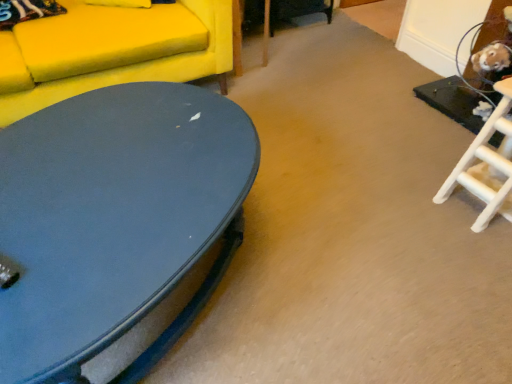
Locate an element on the screen. The height and width of the screenshot is (384, 512). matte yellow fabric couch at upper left is located at coordinates (111, 51).

Describe the element at coordinates (111, 51) in the screenshot. I see `matte yellow fabric couch at upper left` at that location.

Image resolution: width=512 pixels, height=384 pixels. I want to click on matte blue coffee table at lower left, so click(x=114, y=221).

The height and width of the screenshot is (384, 512). What do you see at coordinates (114, 221) in the screenshot?
I see `matte blue coffee table at lower left` at bounding box center [114, 221].

The width and height of the screenshot is (512, 384). What are the coordinates of `matte yellow fabric couch at upper left` in the screenshot? It's located at (111, 51).

Considering the positions of objects matte blue coffee table at lower left and matte yellow fabric couch at upper left in the image provided, who is more to the right, matte blue coffee table at lower left or matte yellow fabric couch at upper left?

Positioned to the right is matte blue coffee table at lower left.

Considering the relative positions of matte blue coffee table at lower left and matte yellow fabric couch at upper left in the image provided, is matte blue coffee table at lower left behind matte yellow fabric couch at upper left?

That is False.

Considering the points (51, 278) and (100, 46), which point is behind, point (51, 278) or point (100, 46)?

Point (100, 46)

From the image's perspective, is matte blue coffee table at lower left positioned above or below matte yellow fabric couch at upper left?

matte blue coffee table at lower left is situated lower than matte yellow fabric couch at upper left in the image.

Consider the image. From a real-world perspective, is matte blue coffee table at lower left located beneath matte yellow fabric couch at upper left?

Yes, from a real-world perspective, matte blue coffee table at lower left is under matte yellow fabric couch at upper left.

Consider the image. Considering the sizes of objects matte blue coffee table at lower left and matte yellow fabric couch at upper left in the image provided, who is wider, matte blue coffee table at lower left or matte yellow fabric couch at upper left?

Wider between the two is matte yellow fabric couch at upper left.

Considering the relative sizes of matte blue coffee table at lower left and matte yellow fabric couch at upper left in the image provided, is matte blue coffee table at lower left taller than matte yellow fabric couch at upper left?

Incorrect, the height of matte blue coffee table at lower left is not larger of that of matte yellow fabric couch at upper left.

Based on the photo, based on their sizes in the image, would you say matte blue coffee table at lower left is bigger or smaller than matte yellow fabric couch at upper left?

In the image, matte blue coffee table at lower left appears to be smaller than matte yellow fabric couch at upper left.

Is matte blue coffee table at lower left surrounding matte yellow fabric couch at upper left?

No, matte yellow fabric couch at upper left is not a part of matte blue coffee table at lower left.

Is matte blue coffee table at lower left touching matte yellow fabric couch at upper left?

No, matte blue coffee table at lower left is not next to matte yellow fabric couch at upper left.

Is matte blue coffee table at lower left aimed at matte yellow fabric couch at upper left?

No, matte blue coffee table at lower left is not aimed at matte yellow fabric couch at upper left.

Locate an element on the screen. This screenshot has width=512, height=384. coffee table on the right side of matte yellow fabric couch at upper left is located at coordinates (114, 221).

Which is more to the right, matte yellow fabric couch at upper left or matte blue coffee table at lower left?

Positioned to the right is matte blue coffee table at lower left.

Which object is closer to the camera taking this photo, matte yellow fabric couch at upper left or matte blue coffee table at lower left?

matte blue coffee table at lower left is more forward.

Which is further, [42,105] or [169,335]?

The point [42,105] is more distant.

From the image's perspective, is matte yellow fabric couch at upper left positioned above or below matte blue coffee table at lower left?

Based on their image positions, matte yellow fabric couch at upper left is located above matte blue coffee table at lower left.

From a real-world perspective, between matte yellow fabric couch at upper left and matte blue coffee table at lower left, who is vertically higher?

In real-world perspective, matte yellow fabric couch at upper left is above.

Which object is wider, matte yellow fabric couch at upper left or matte blue coffee table at lower left?

With larger width is matte yellow fabric couch at upper left.

Is matte yellow fabric couch at upper left shorter than matte blue coffee table at lower left?

In fact, matte yellow fabric couch at upper left may be taller than matte blue coffee table at lower left.

Is matte yellow fabric couch at upper left smaller than matte blue coffee table at lower left?

No.

Would you say matte yellow fabric couch at upper left is inside or outside matte blue coffee table at lower left?

matte yellow fabric couch at upper left lies outside matte blue coffee table at lower left.

Are matte yellow fabric couch at upper left and matte blue coffee table at lower left making contact?

matte yellow fabric couch at upper left is not next to matte blue coffee table at lower left, and they're not touching.

Is matte yellow fabric couch at upper left facing towards matte blue coffee table at lower left?

Yes, matte yellow fabric couch at upper left faces towards matte blue coffee table at lower left.

How different are the orientations of matte yellow fabric couch at upper left and matte blue coffee table at lower left in degrees?

They differ by 32.2 degrees in their facing directions.

How distant is matte yellow fabric couch at upper left from matte blue coffee table at lower left?

They are 22.49 inches apart.

This screenshot has height=384, width=512. I want to click on studio couch located above the matte blue coffee table at lower left (from the image's perspective), so click(x=111, y=51).

In the image, there is a matte yellow fabric couch at upper left. Where is `coffee table below it (from a real-world perspective)`? The image size is (512, 384). coffee table below it (from a real-world perspective) is located at coordinates (114, 221).

This screenshot has height=384, width=512. I want to click on studio couch that appears behind the matte blue coffee table at lower left, so click(111, 51).